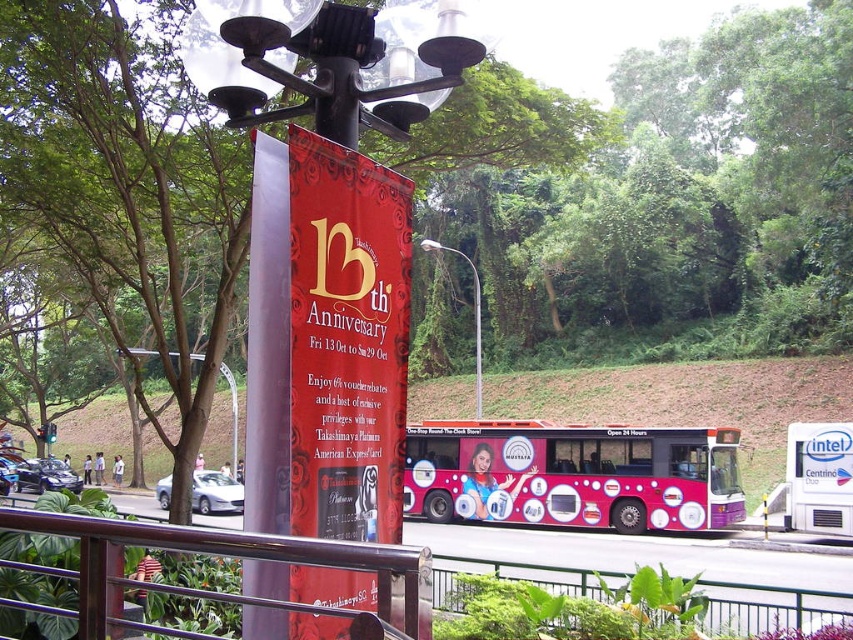
Is metallic black lamp post at center wider than pink glossy bus at center?

Correct, the width of metallic black lamp post at center exceeds that of pink glossy bus at center.

Can you confirm if metallic black lamp post at center is positioned above pink glossy bus at center?

Yes.

Does point (196, 12) lie in front of point (845, 496)?

Yes, point (196, 12) is in front of point (845, 496).

Find the location of `metallic black lamp post at center`. metallic black lamp post at center is located at coordinates (331, 60).

Is point (602, 570) farther from viewer compared to point (785, 468)?

No, (602, 570) is closer to viewer.

Is metal at center below pink glossy bus at center?

Yes.

Is point (712, 580) farther from camera compared to point (786, 493)?

No, (712, 580) is in front of (786, 493).

This screenshot has height=640, width=853. Find the location of `metal at center`. metal at center is located at coordinates [770, 605].

Is shiny pink bus at center positioned at the back of metallic silver streetlight at center?

That is False.

Can you confirm if shiny pink bus at center is positioned above metallic silver streetlight at center?

Actually, shiny pink bus at center is below metallic silver streetlight at center.

Who is more forward, [558,512] or [477,387]?

Point [558,512]

Locate an element on the screen. The width and height of the screenshot is (853, 640). shiny pink bus at center is located at coordinates (573, 474).